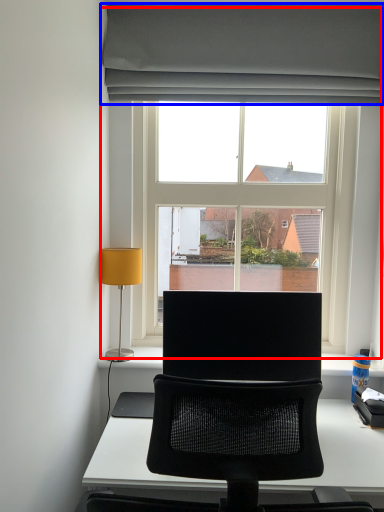
Question: Which point is closer to the camera, window (highlighted by a red box) or curtain (highlighted by a blue box)?

Choices:
 (A) window
 (B) curtain

Answer: (B)